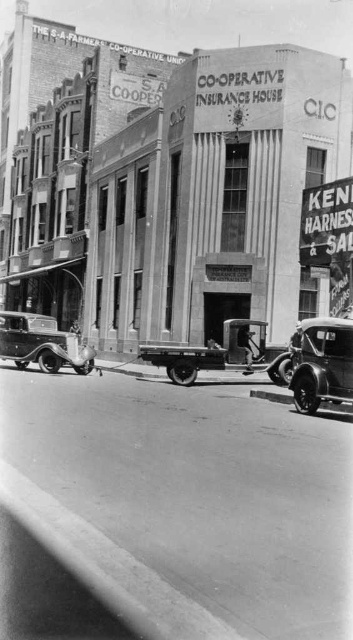
Does shiny chrome car at right appear under shiny silver car at lower left?

Yes.

Is shiny chrome car at right further to camera compared to shiny silver car at lower left?

No, it is not.

Is point (345, 337) positioned in front of point (8, 312)?

Yes, it is.

I want to click on shiny chrome car at right, so pyautogui.click(x=322, y=364).